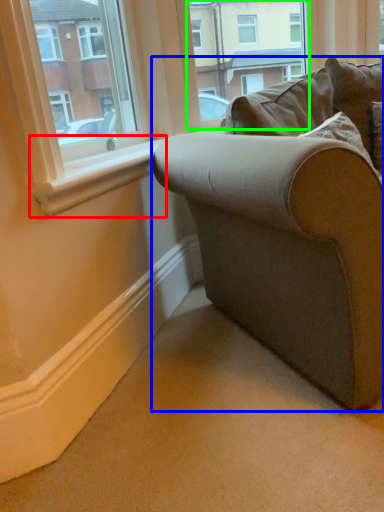
Question: Which object is the closest to the window sill (highlighted by a red box)? Choose among these: studio couch (highlighted by a blue box) or window frame (highlighted by a green box).

Choices:
 (A) studio couch
 (B) window frame

Answer: (A)